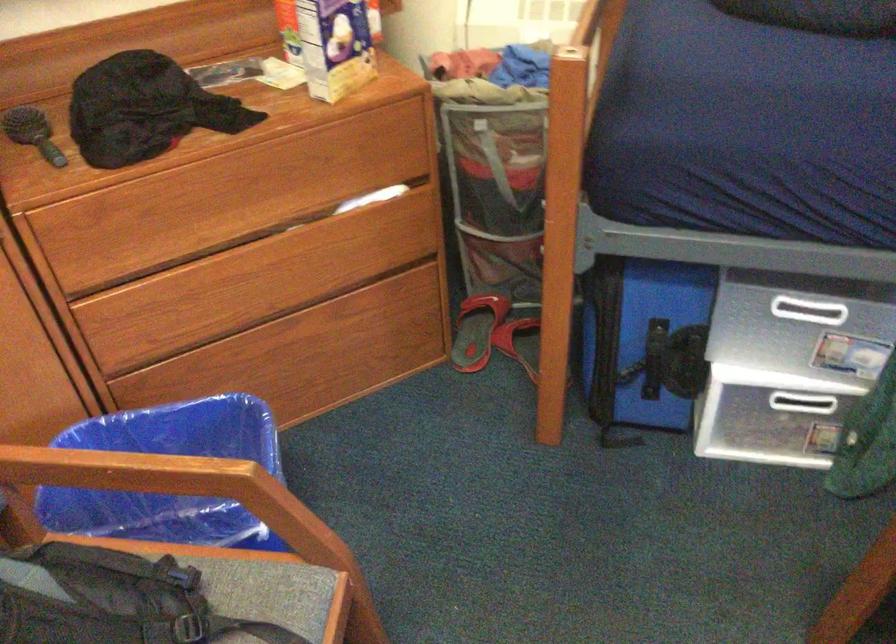
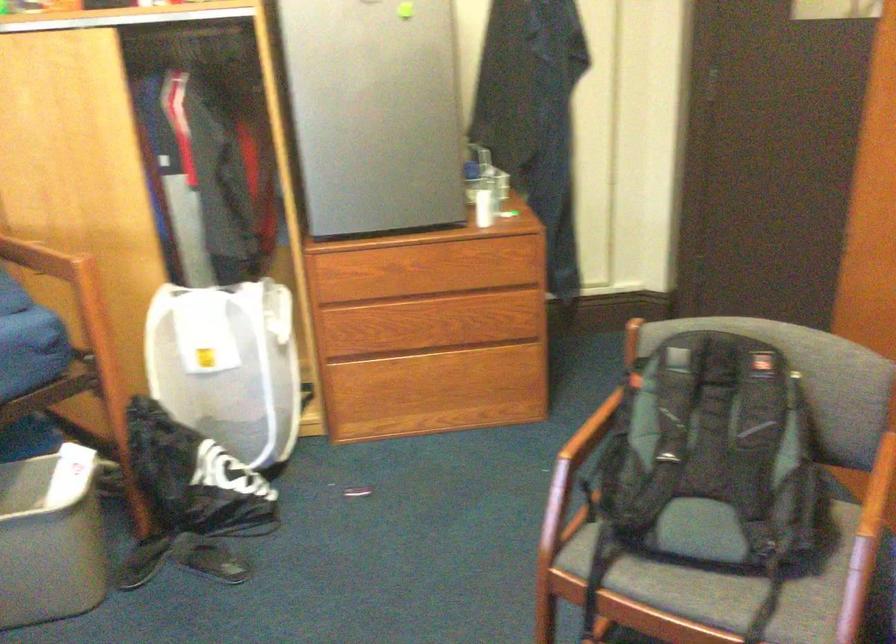
The first image is from the beginning of the video and the second image is from the end. How did the camera likely rotate when shooting the video?

The rotation direction of the camera is left-down.